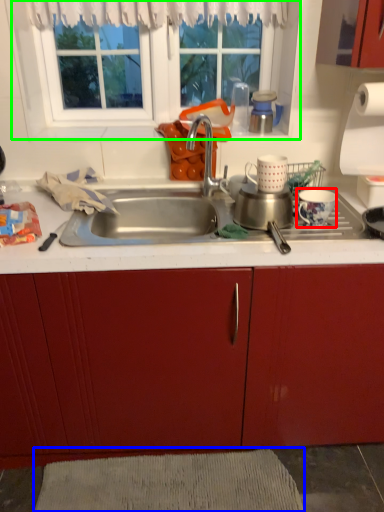
Question: Estimate the real-world distances between objects in this image. Which object is farther from coffee cup (highlighted by a red box), plain (highlighted by a blue box) or window (highlighted by a green box)?

Choices:
 (A) plain
 (B) window

Answer: (A)